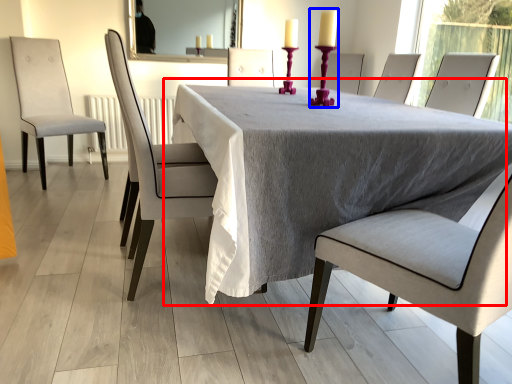
Question: Which of the following is the closest to the observer, table (highlighted by a red box) or candle holder (highlighted by a blue box)?

Choices:
 (A) table
 (B) candle holder

Answer: (A)